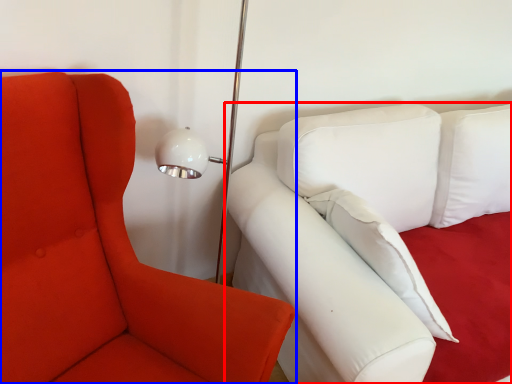
Question: Which object is further to the camera taking this photo, studio couch (highlighted by a red box) or chair (highlighted by a blue box)?

Choices:
 (A) studio couch
 (B) chair

Answer: (A)